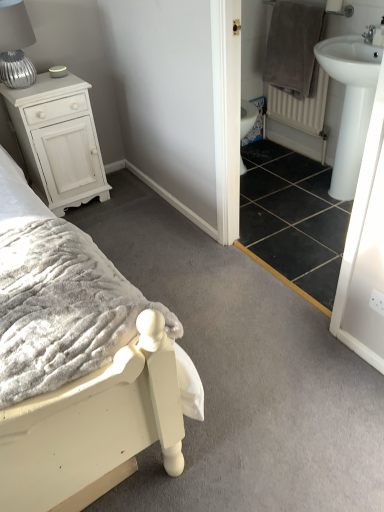
Where is `vacant space underneath white textured radiator at right (from a real-world perspective)`? vacant space underneath white textured radiator at right (from a real-world perspective) is located at coordinates (291, 151).